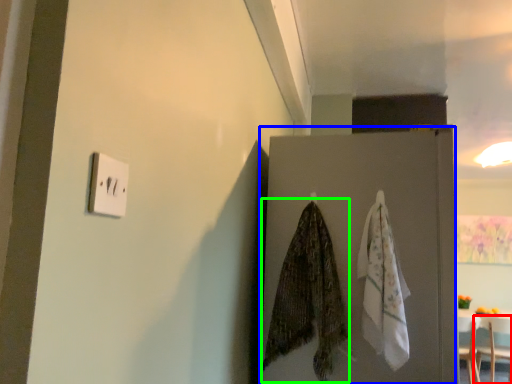
Question: Based on their relative distances, which object is farther from furniture (highlighted by a red box)? Choose from door (highlighted by a blue box) and clothe (highlighted by a green box).

Choices:
 (A) door
 (B) clothe

Answer: (B)